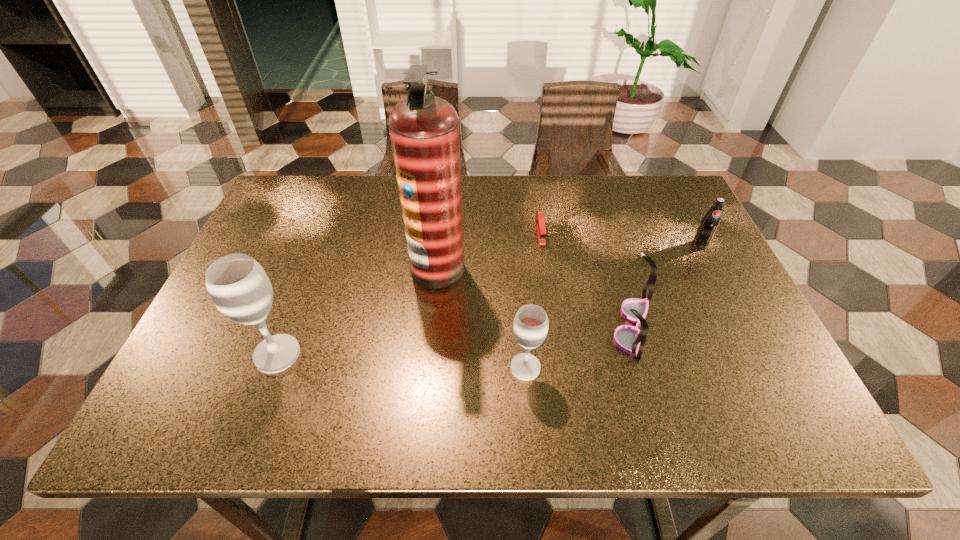
Identify the location of vacant space positioned on the right of the left wineglass. Image resolution: width=960 pixels, height=540 pixels. [x=419, y=355].

This screenshot has height=540, width=960. I want to click on free space located 0.050m on the back of the third object from left to right, so click(522, 335).

Find the location of `vacant space located at the nozzle of the fire extinguisher`. vacant space located at the nozzle of the fire extinguisher is located at coordinates (543, 267).

The width and height of the screenshot is (960, 540). Identify the location of vacant point located on the front label of the rightmost object. (722, 286).

Image resolution: width=960 pixels, height=540 pixels. Find the location of `vacant space positioned on the front-facing side of the shortest object`. vacant space positioned on the front-facing side of the shortest object is located at coordinates (548, 287).

The height and width of the screenshot is (540, 960). Identify the location of vacant space located 0.240m on the back of the second object from right to left. (605, 231).

You are a GUI agent. You are given a task and a screenshot of the screen. Output one action in this format:
    pyautogui.click(x=<x>, y=<y>)
    Task: Click on the object at the far edge
    This screenshot has height=540, width=960.
    Given the screenshot: What is the action you would take?
    pyautogui.click(x=540, y=221)

Where is `spectacles situated at the near edge`? The height and width of the screenshot is (540, 960). spectacles situated at the near edge is located at coordinates (630, 339).

The width and height of the screenshot is (960, 540). I want to click on object present at the left edge, so click(x=239, y=287).

You are a GUI agent. You are given a task and a screenshot of the screen. Output one action in this format:
    pyautogui.click(x=<x>, y=<y>)
    Task: Click on the object that is at the right edge
    
    Given the screenshot: What is the action you would take?
    pyautogui.click(x=708, y=226)